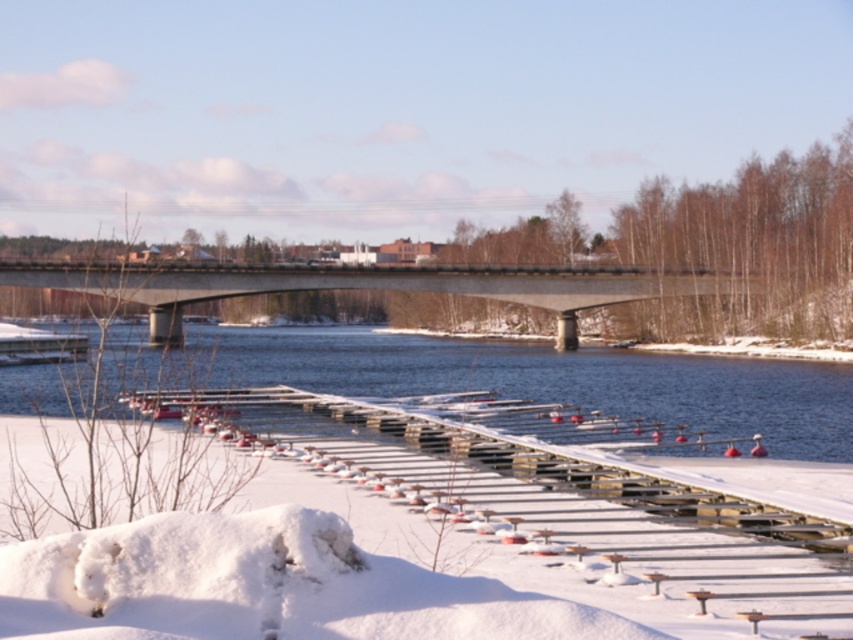
Question: Is blue water at center bigger than concrete bridge at center?

Choices:
 (A) no
 (B) yes

Answer: (A)

Question: Is blue water at center positioned before concrete bridge at center?

Choices:
 (A) no
 (B) yes

Answer: (B)

Question: Among these points, which one is farthest from the camera?

Choices:
 (A) (184, 292)
 (B) (399, 364)

Answer: (A)

Question: From the image, what is the correct spatial relationship of blue water at center in relation to concrete bridge at center?

Choices:
 (A) above
 (B) below

Answer: (B)